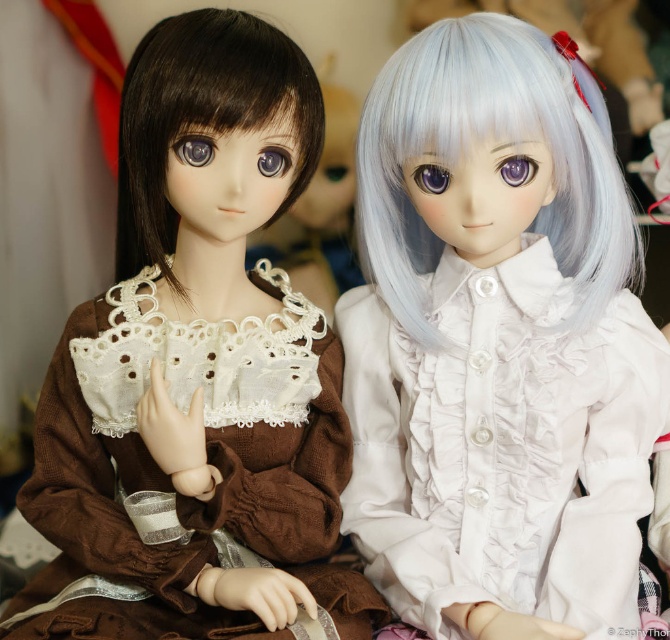
Does satin white blouse at center appear on the left side of semi-glossy white wig at center?

Indeed, satin white blouse at center is positioned on the left side of semi-glossy white wig at center.

You are a GUI agent. You are given a task and a screenshot of the screen. Output one action in this format:
    pyautogui.click(x=<x>, y=<y>)
    Task: Click on the satin white blouse at center
    This screenshot has width=670, height=640.
    Given the screenshot: What is the action you would take?
    pyautogui.click(x=496, y=342)

Does satin white blouse at center have a lesser height compared to brown corduroy dress at left?

Incorrect, satin white blouse at center's height does not fall short of brown corduroy dress at left's.

Does satin white blouse at center have a smaller size compared to brown corduroy dress at left?

Yes, satin white blouse at center is smaller than brown corduroy dress at left.

Does point (620, 618) come behind point (149, 56)?

No, (620, 618) is closer to viewer.

You are a GUI agent. You are given a task and a screenshot of the screen. Output one action in this format:
    pyautogui.click(x=<x>, y=<y>)
    Task: Click on the satin white blouse at center
    
    Given the screenshot: What is the action you would take?
    pyautogui.click(x=496, y=342)

Between brown corduroy dress at left and brown silky hair at left, which one has more height?

brown corduroy dress at left

Who is more distant from viewer, (234, 564) or (159, 29)?

Point (234, 564)

Which is in front, point (170, 385) or point (129, 72)?

Positioned in front is point (170, 385).

You are a GUI agent. You are given a task and a screenshot of the screen. Output one action in this format:
    pyautogui.click(x=<x>, y=<y>)
    Task: Click on the brown corduroy dress at left
    
    Given the screenshot: What is the action you would take?
    pyautogui.click(x=198, y=372)